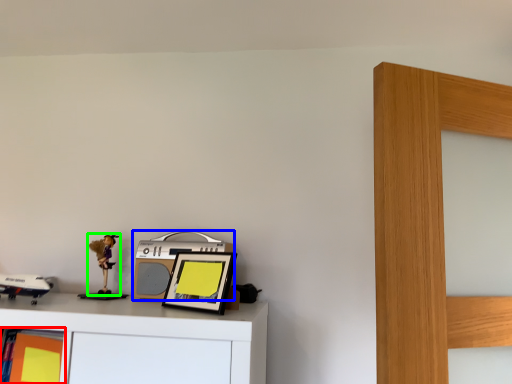
Question: Considering the real-world distances, which object is closest to shelf (highlighted by a red box)? stereo (highlighted by a blue box) or toy (highlighted by a green box).

Choices:
 (A) stereo
 (B) toy

Answer: (B)